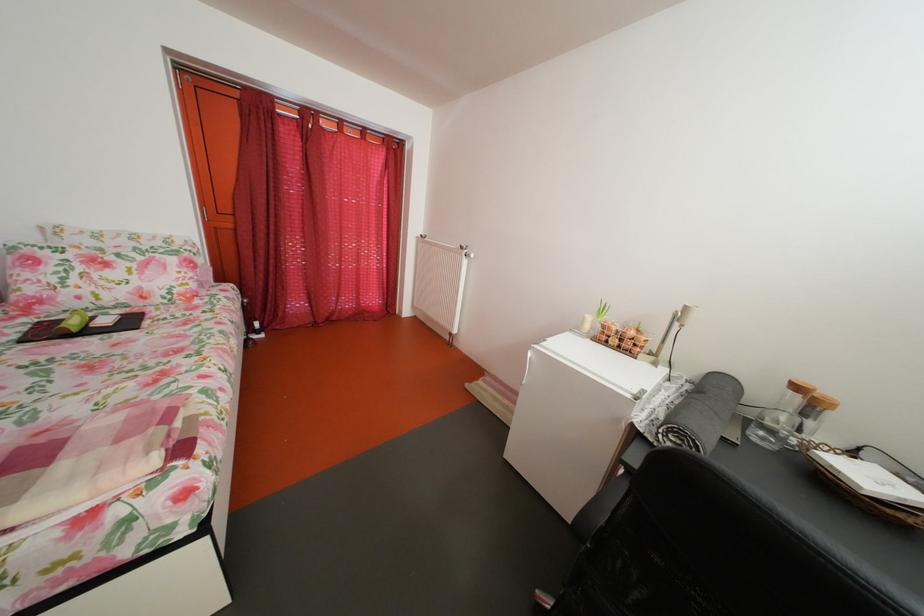
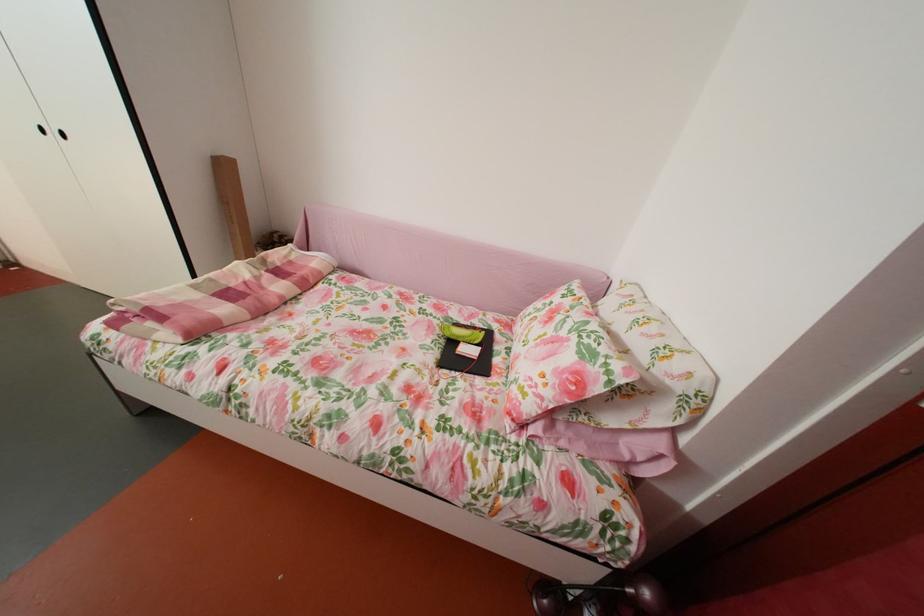
Locate, in the second image, the point that corresponds to (27,342) in the first image.

(473, 328)